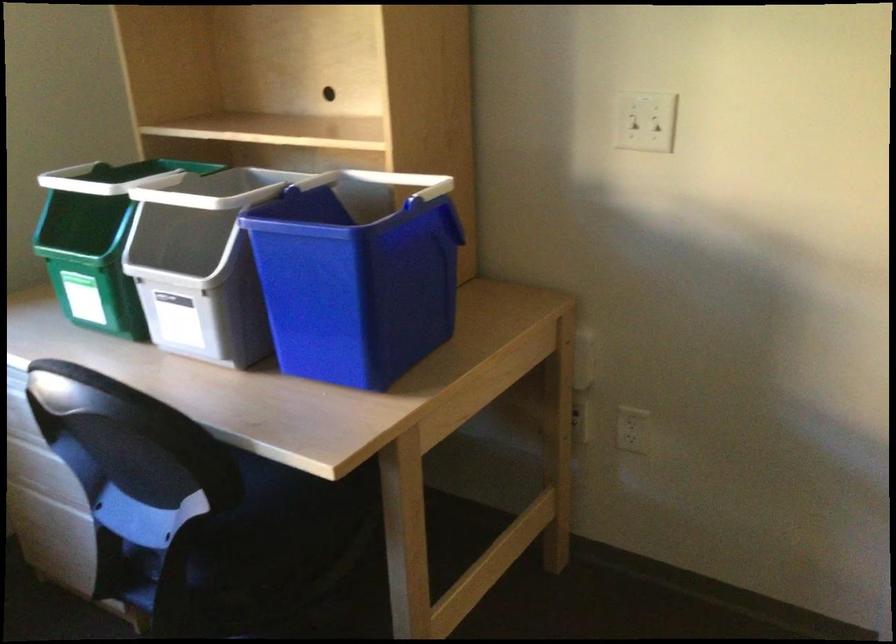
Where is `chair sitting surface`? The image size is (896, 644). chair sitting surface is located at coordinates (151, 518).